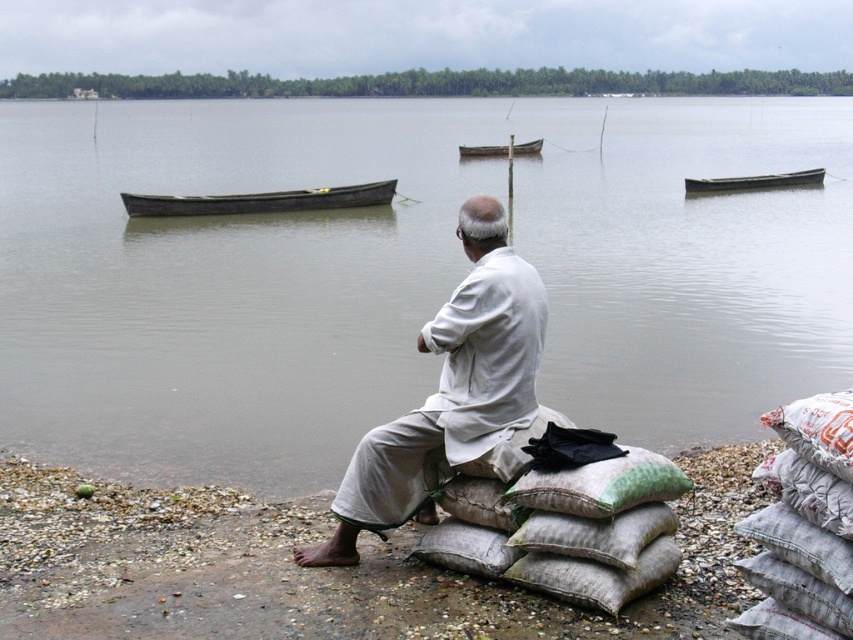
You are standing at the edge of the river and want to reach the wooden canoe at center. Which direction should you move to get there from the gray gravel shoreline at lower left?

The gray gravel shoreline at lower left is in front of the wooden canoe at center, so you should move towards the wooden canoe at center from the gray gravel shoreline at lower left.

You are a traveler who needs to cross the river. You see a wooden canoe at center and a wooden boat at center. Which one is closer to you?

Both the wooden canoe at center and the wooden boat at center are at the same distance from you since they are both located at the center of the image.